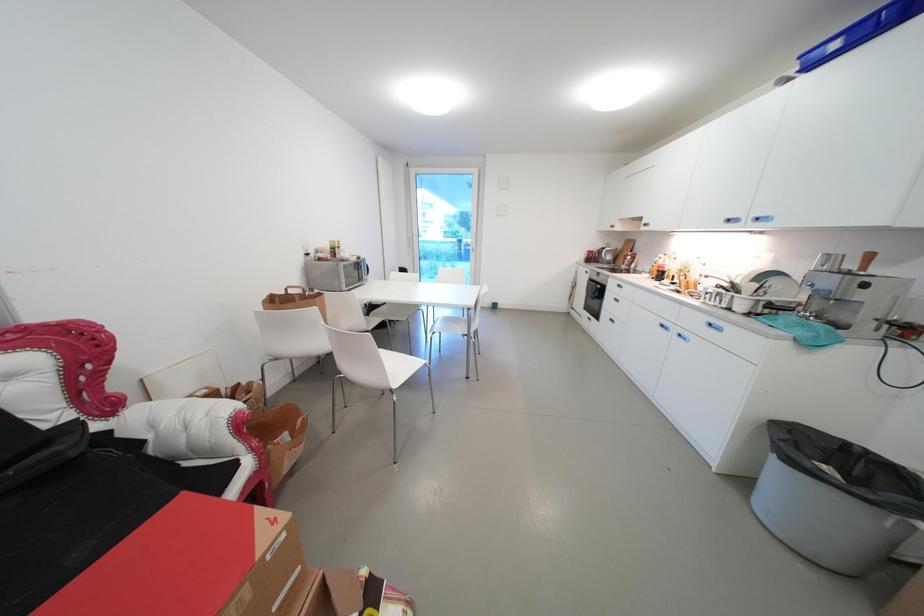
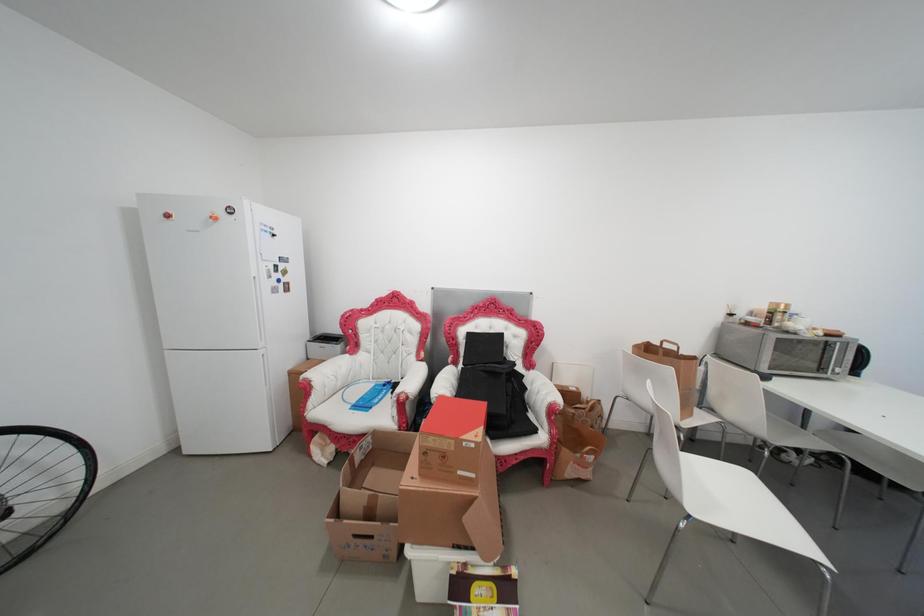
Question: The first image is from the beginning of the video and the second image is from the end. How did the camera likely rotate when shooting the video?

Choices:
 (A) Left
 (B) Right
 (C) Up
 (D) Down

Answer: (A)